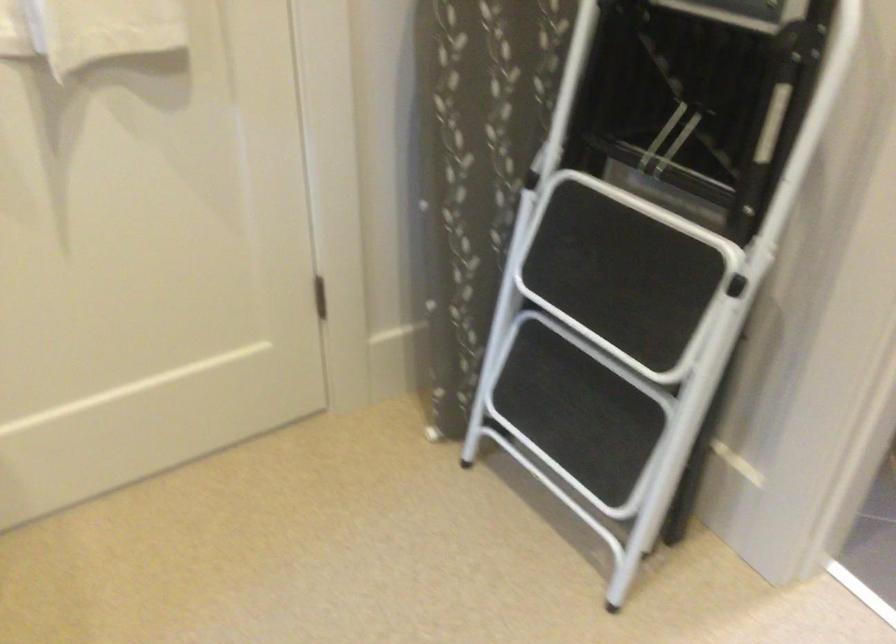
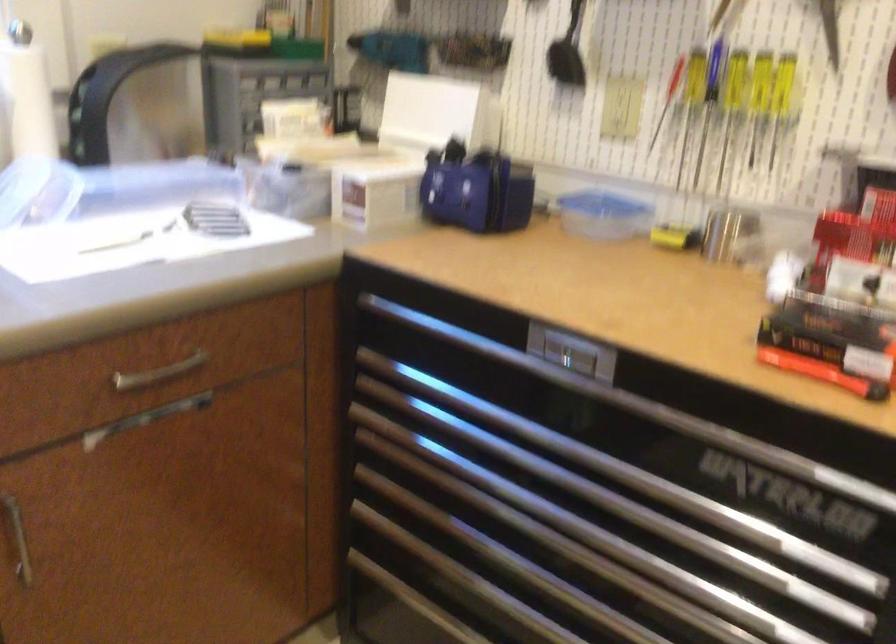
Question: Based on the continuous images, in which direction is the camera rotating? Reply with the corresponding letter.

Choices:
 (A) Left
 (B) Right
 (C) Up
 (D) Down

Answer: (A)